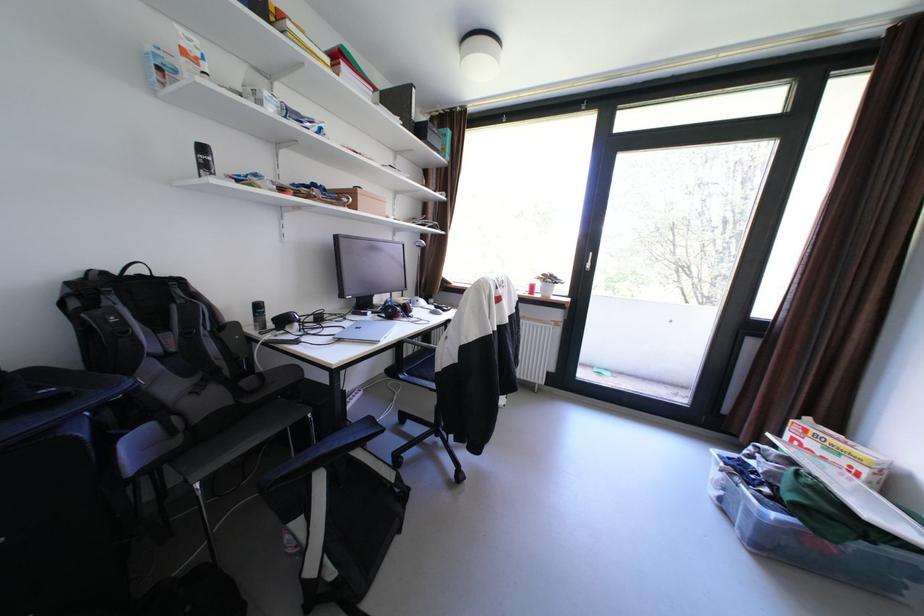
I want to click on black computer mouse, so click(x=388, y=310).